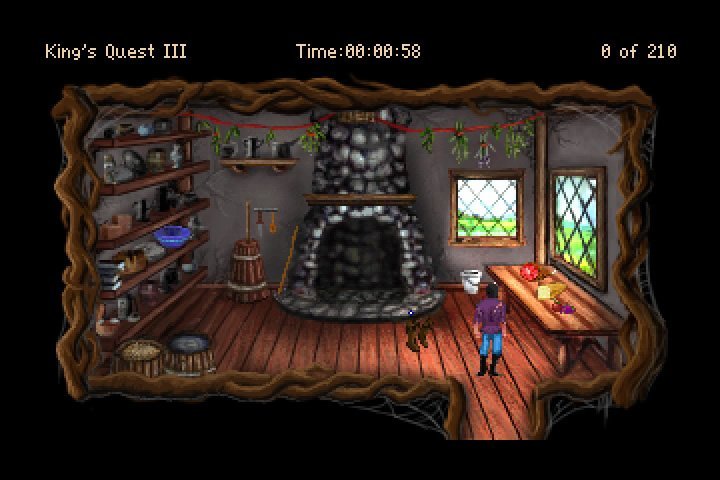
The height and width of the screenshot is (480, 720). I want to click on window, so click(481, 210), click(571, 223).